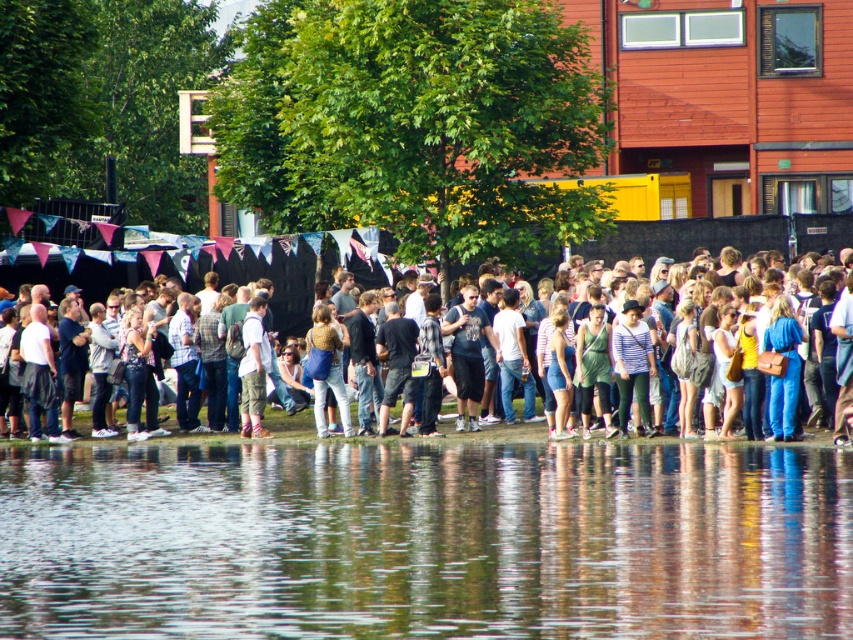
You are standing at the edge of the water in the scene and want to move towards the point labeled point [263,605]. Which direction should you walk relative to the point labeled point [51,269]?

Since point [263,605] is closer to the viewer than point [51,269], you should walk towards the direction of point [263,605], which is closer to you compared to point [51,269].

You are standing at the edge of the water and see two points marked in the scene. Which point is closer to you, point (286, 317) or point (247, 422)?

Point (286, 317) is closer to you because it is further to the viewer than point (247, 422).